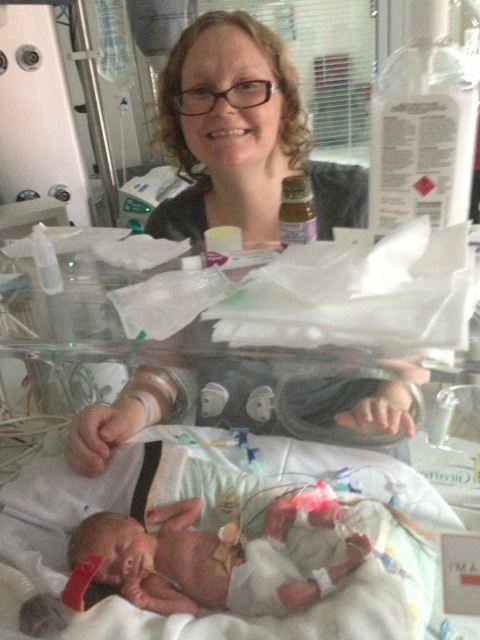
Question: Can you confirm if matte black hair at upper center is bigger than smooth skin newborn at lower left?

Choices:
 (A) no
 (B) yes

Answer: (B)

Question: Does matte black hair at upper center appear under smooth skin newborn at lower left?

Choices:
 (A) yes
 (B) no

Answer: (B)

Question: Is matte black hair at upper center thinner than smooth skin newborn at lower left?

Choices:
 (A) yes
 (B) no

Answer: (B)

Question: Which of the following is the farthest from the observer?

Choices:
 (A) (180, 410)
 (B) (108, 525)

Answer: (A)

Question: Which object appears farthest from the camera in this image?

Choices:
 (A) matte black hair at upper center
 (B) smooth skin newborn at lower left

Answer: (A)